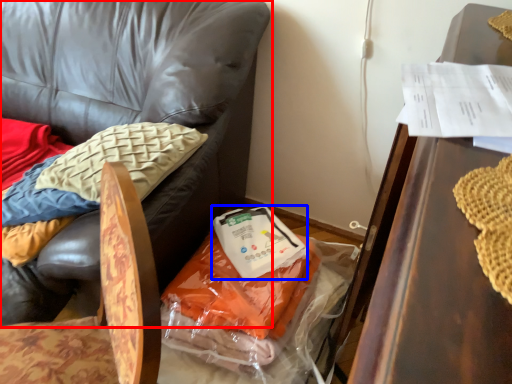
Question: Which object appears closest to the camera in this image, chair (highlighted by a red box) or food (highlighted by a blue box)?

Choices:
 (A) chair
 (B) food

Answer: (A)